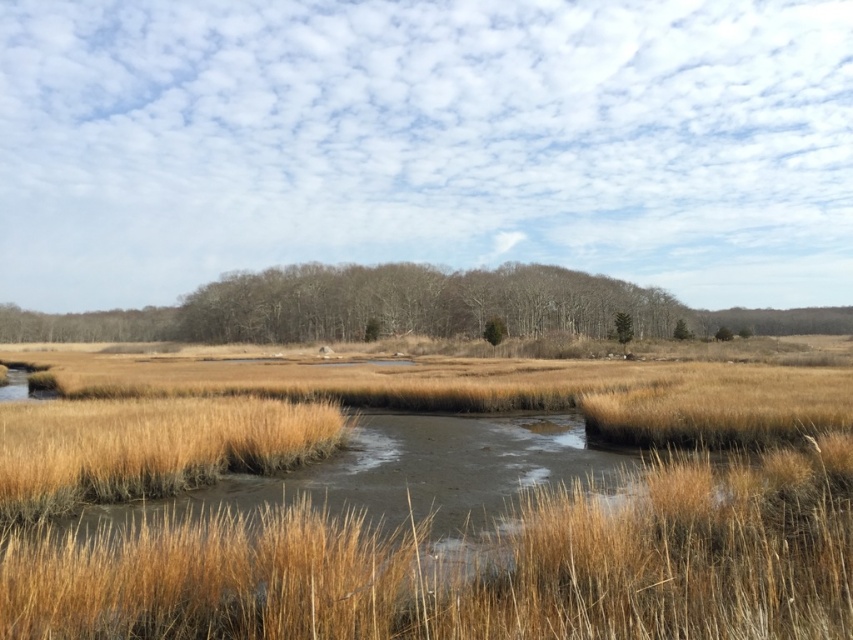
Can you confirm if brown textured trees at center is smaller than green matte tree at center?

No, brown textured trees at center is not smaller than green matte tree at center.

Is brown textured trees at center below green matte tree at center?

Actually, brown textured trees at center is above green matte tree at center.

This screenshot has width=853, height=640. Identify the location of brown textured trees at center. (416, 304).

Where is `brown textured trees at center`? brown textured trees at center is located at coordinates 416,304.

Who is taller, brown textured trees at center or green matte tree at center-right?

With more height is brown textured trees at center.

From the picture: Does brown textured trees at center appear under green matte tree at center-right?

Actually, brown textured trees at center is above green matte tree at center-right.

Is point (589, 292) positioned after point (624, 316)?

Yes.

Identify the location of brown textured trees at center. The width and height of the screenshot is (853, 640). (416, 304).

Between green matte tree at center-right and green matte tree at center, which one appears on the left side from the viewer's perspective?

green matte tree at center-right is more to the left.

Is point (619, 314) closer to camera compared to point (683, 324)?

Yes, it is.

This screenshot has height=640, width=853. Find the location of `green matte tree at center-right`. green matte tree at center-right is located at coordinates tap(624, 326).